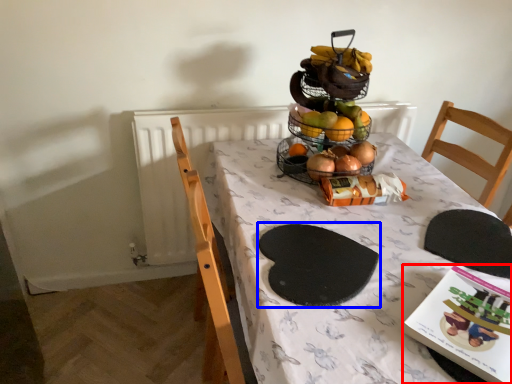
Question: Which point is closer to the camera, book (highlighted by a red box) or mat (highlighted by a blue box)?

Choices:
 (A) book
 (B) mat

Answer: (A)